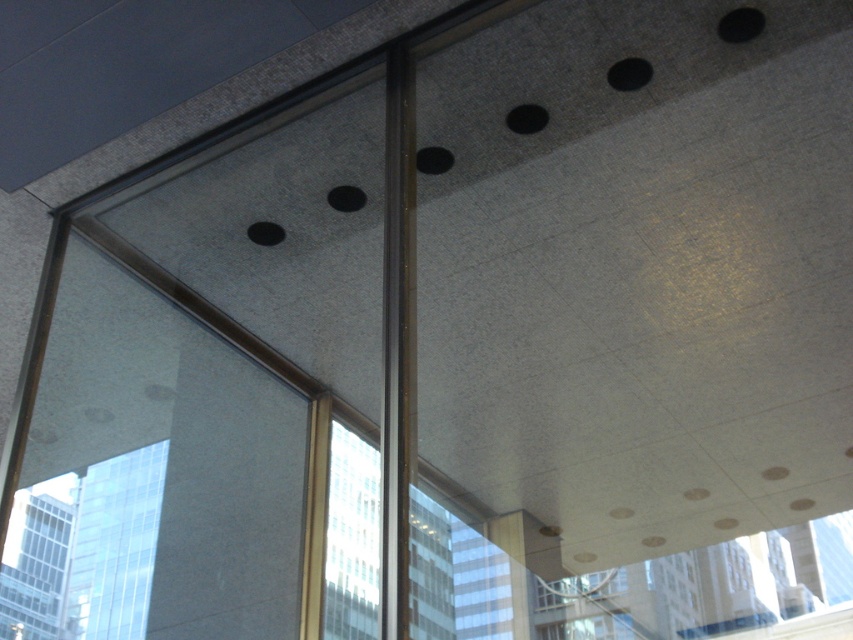
Is point (640, 604) positioned before point (77, 560)?

Yes, it is.

Who is higher up, transparent glass window at lower right or transparent glass window at lower left?

transparent glass window at lower right is above.

Which is behind, point (735, 628) or point (53, 557)?

The point (53, 557) is more distant.

What are the coordinates of `transparent glass window at lower right` in the screenshot? It's located at (705, 588).